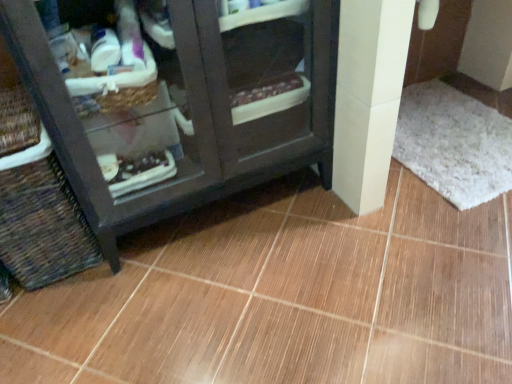
At what (x,y) coordinates should I click in order to perform the action: click on free space in front of dark wood cabinet at lower left. Please return your answer as a coordinate pair (x, y). Looking at the image, I should click on (224, 301).